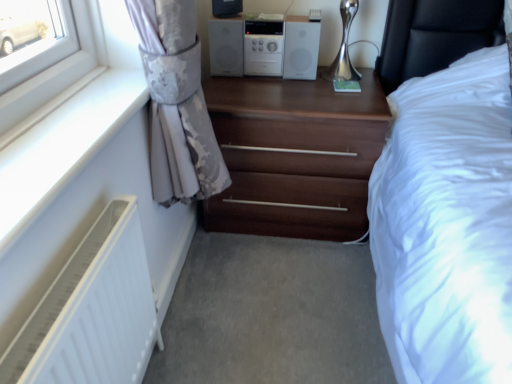
The width and height of the screenshot is (512, 384). Find the location of `free space in front of dark wood chest of drawers at center`. free space in front of dark wood chest of drawers at center is located at coordinates (278, 299).